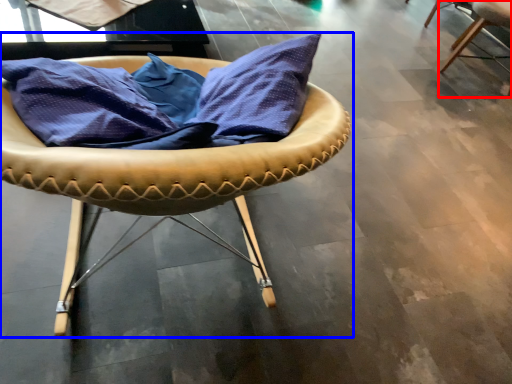
Question: Which of the following is the farthest to the observer, chair (highlighted by a red box) or chair (highlighted by a blue box)?

Choices:
 (A) chair
 (B) chair

Answer: (A)